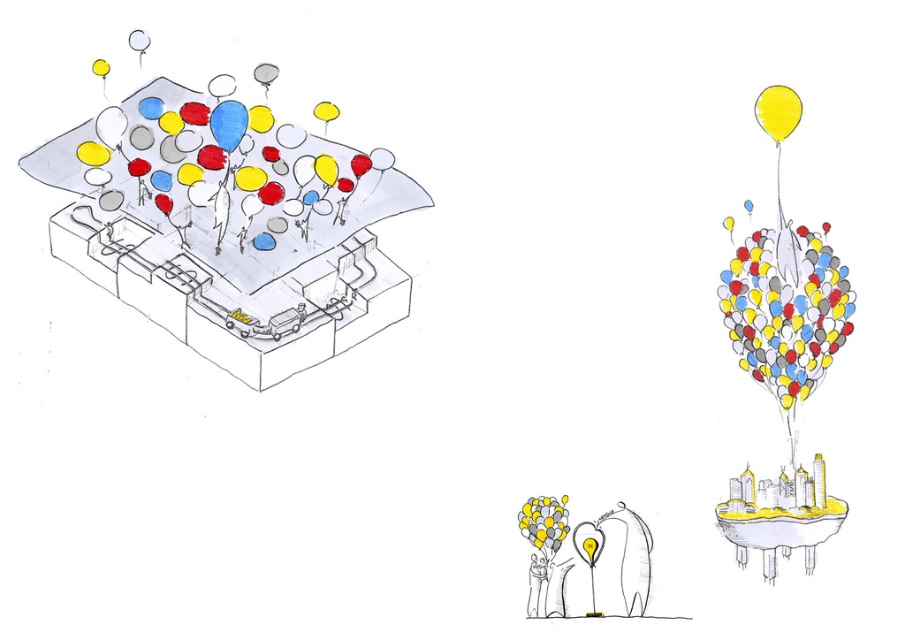
Does matte gray box at center appear under yellow matte balloon at upper right?

Indeed, matte gray box at center is positioned under yellow matte balloon at upper right.

Measure the distance from matte gray box at center to yellow matte balloon at upper right.

matte gray box at center is 16.16 inches away from yellow matte balloon at upper right.

Is point (136, 300) positioned before point (772, 118)?

No.

Identify the location of matte gray box at center. The image size is (905, 640). (237, 294).